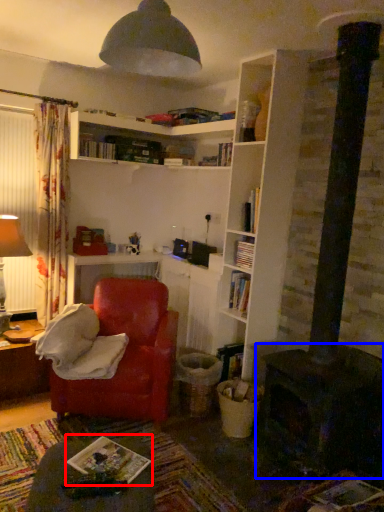
Question: Which object appears closest to the camera in this image, book (highlighted by a red box) or fireplace (highlighted by a blue box)?

Choices:
 (A) book
 (B) fireplace

Answer: (A)